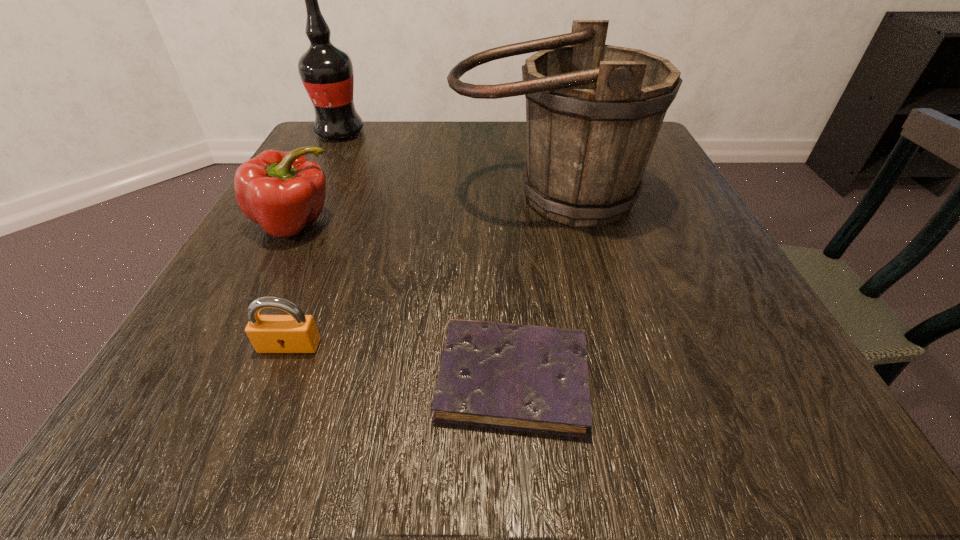
Find the location of `free space at the left edge of the desktop`. free space at the left edge of the desktop is located at coordinates (303, 238).

In the image, there is a desktop. Identify the location of vacant space at the right edge. (658, 252).

This screenshot has height=540, width=960. Identify the location of vacant position at the far left corner of the desktop. (330, 168).

Identify the location of free space at the near right corner. (793, 402).

This screenshot has width=960, height=540. What are the coordinates of `free space between the shortest object and the wine bottle` in the screenshot? It's located at (426, 255).

Identify the location of empty space between the third shortest object and the second shortest object. 293,285.

Where is `unoccupied position between the second tallest object and the shortest object`? Image resolution: width=960 pixels, height=540 pixels. unoccupied position between the second tallest object and the shortest object is located at coordinates (530, 287).

Where is `blank region between the second tallest object and the padlock`? blank region between the second tallest object and the padlock is located at coordinates (419, 271).

Image resolution: width=960 pixels, height=540 pixels. Identify the location of empty location between the shortest object and the wine bottle. (426, 255).

Identify the location of unoccupied area between the padlock and the diary. (401, 362).